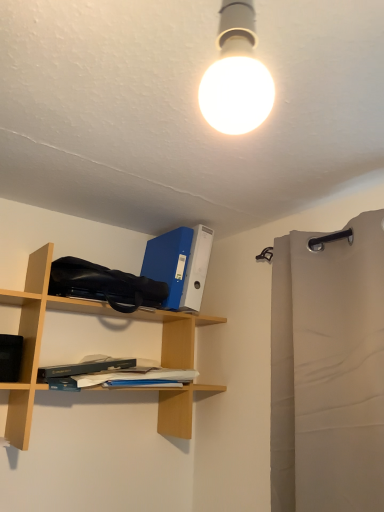
Question: Is hardcover book at center shorter than beige fabric curtain at right?

Choices:
 (A) yes
 (B) no

Answer: (A)

Question: Is hardcover book at center smaller than beige fabric curtain at right?

Choices:
 (A) no
 (B) yes

Answer: (B)

Question: Is hardcover book at center turned away from beige fabric curtain at right?

Choices:
 (A) yes
 (B) no

Answer: (B)

Question: Is beige fabric curtain at right surrounded by hardcover book at center?

Choices:
 (A) no
 (B) yes

Answer: (A)

Question: From a real-world perspective, is hardcover book at center under beige fabric curtain at right?

Choices:
 (A) yes
 (B) no

Answer: (A)

Question: Considering the relative sizes of hardcover book at center and beige fabric curtain at right in the image provided, is hardcover book at center bigger than beige fabric curtain at right?

Choices:
 (A) no
 (B) yes

Answer: (A)

Question: Can you confirm if beech wood shelf at left is wider than hardcover book at center?

Choices:
 (A) no
 (B) yes

Answer: (B)

Question: From the image's perspective, is beech wood shelf at left on hardcover book at center?

Choices:
 (A) yes
 (B) no

Answer: (A)

Question: From a real-world perspective, is beech wood shelf at left below hardcover book at center?

Choices:
 (A) no
 (B) yes

Answer: (A)

Question: Is beech wood shelf at left further to camera compared to hardcover book at center?

Choices:
 (A) yes
 (B) no

Answer: (B)

Question: Does beech wood shelf at left appear on the left side of hardcover book at center?

Choices:
 (A) yes
 (B) no

Answer: (A)

Question: Is beech wood shelf at left turned away from hardcover book at center?

Choices:
 (A) yes
 (B) no

Answer: (A)

Question: Can you confirm if beige fabric curtain at right is thinner than beech wood shelf at left?

Choices:
 (A) no
 (B) yes

Answer: (B)